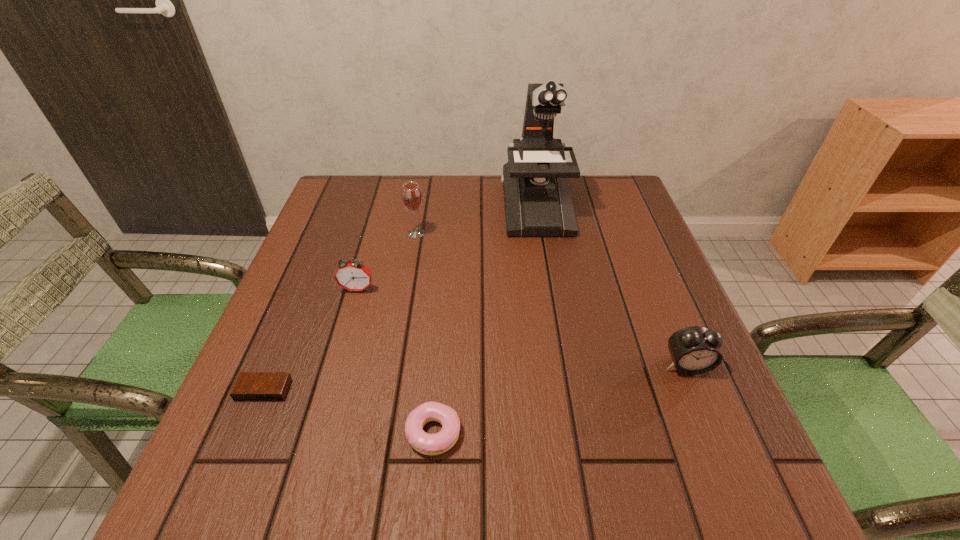
Identify the location of vacant space that is in between the doughnut and the second object from left to right. (396, 361).

At what (x,y) coordinates should I click in order to perform the action: click on free space that is in between the second object from left to right and the shortest alarm clock. Please return your answer as a coordinate pair (x, y). This screenshot has width=960, height=540. Looking at the image, I should click on (310, 340).

The width and height of the screenshot is (960, 540). Find the location of `unoccupied area between the microscope and the second farthest alarm clock`. unoccupied area between the microscope and the second farthest alarm clock is located at coordinates (611, 286).

The height and width of the screenshot is (540, 960). I want to click on unoccupied position between the fifth object from left to right and the second alarm clock from right to left, so click(446, 247).

Locate an element on the screen. vacant space that is in between the second object from right to left and the third farthest object is located at coordinates (446, 247).

This screenshot has height=540, width=960. Find the location of `vacant area that lies between the third object from left to right and the fourth farthest object`. vacant area that lies between the third object from left to right and the fourth farthest object is located at coordinates tap(551, 299).

Where is `free area in between the tallest object and the fifth shortest object`? free area in between the tallest object and the fifth shortest object is located at coordinates (476, 220).

Select which object is the second closest to the second object from right to left. Please provide its 2D coordinates. Your answer should be formatted as a tuple, i.e. [(x, y)], where the tuple contains the x and y coordinates of a point satisfying the conditions above.

[(351, 275)]

Select which object appears as the closest to the fourth farthest object. Please provide its 2D coordinates. Your answer should be formatted as a tuple, i.e. [(x, y)], where the tuple contains the x and y coordinates of a point satisfying the conditions above.

[(537, 198)]

The width and height of the screenshot is (960, 540). Identify the location of alarm clock that stands as the third closest to the second tallest object. (695, 350).